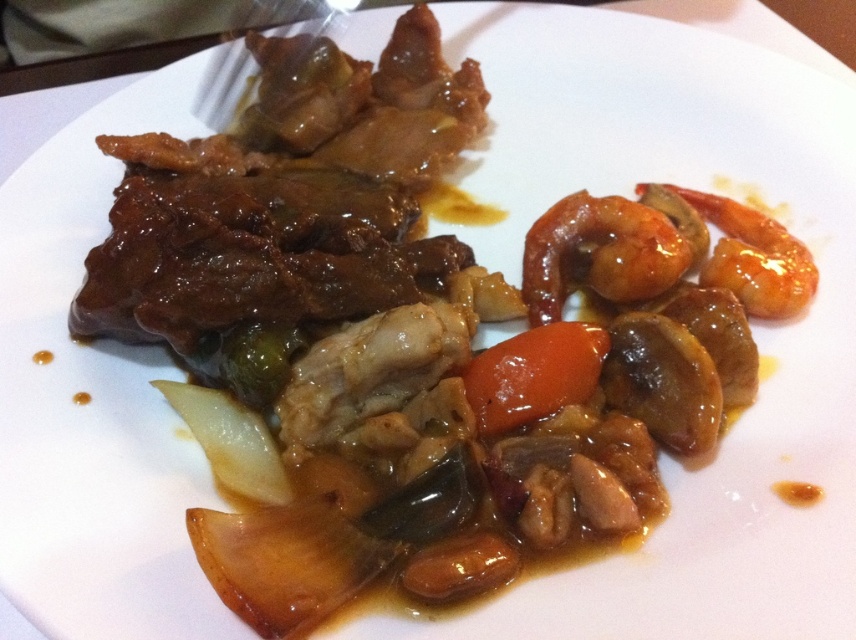
You are a food critic standing at the edge of the plate. You want to reach the point at the back of the plate. Which point should you aim for, point at (562, 240) or point at (214, 115)?

Point at (214, 115) is the point at the back of the plate since it is behind point at (562, 240).

What are the coordinates of the glossy orange carrot at center?

The glossy orange carrot at center is located at coordinates point (x=533, y=374).

You are a chef preparing a dish and need to arrange ingredients based on their sizes. You have a glossy orange carrot at center and a glossy orange shrimp at right. Which ingredient should you place in a spot that requires a wider ingredient?

The glossy orange shrimp at right should be placed in the spot requiring a wider ingredient because its width is greater than the glossy orange carrot at center.